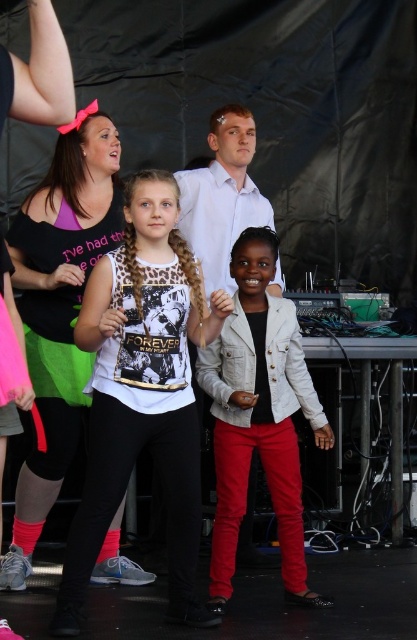
Question: Which point is farther to the camera?

Choices:
 (A) light gray denim jacket at center
 (B) leopard print tank top at center

Answer: (A)

Question: Does leopard print tank top at center appear under light gray denim jacket at center?

Choices:
 (A) no
 (B) yes

Answer: (A)

Question: Where is leopard print tank top at center located in relation to light gray denim jacket at center in the image?

Choices:
 (A) above
 (B) below

Answer: (A)

Question: In this image, where is leopard print tank top at center located relative to light gray denim jacket at center?

Choices:
 (A) below
 (B) above

Answer: (B)